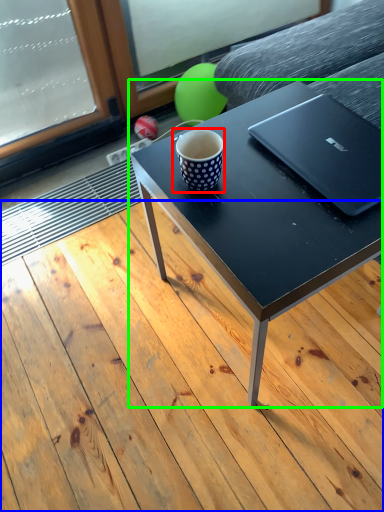
Question: Which object is the closest to the coffee cup (highlighted by a red box)? Choose among these: plank (highlighted by a blue box) or coffee table (highlighted by a green box).

Choices:
 (A) plank
 (B) coffee table

Answer: (B)